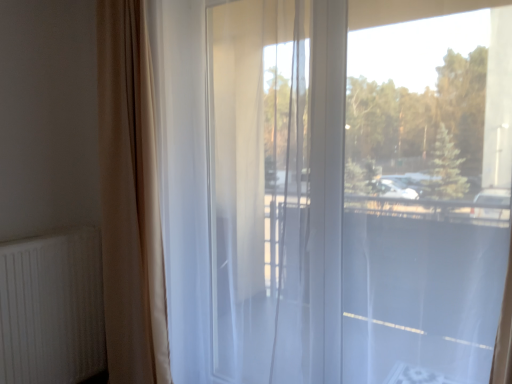
Question: Does transparent glass window at center lie in front of white ribbed radiator at lower left?

Choices:
 (A) yes
 (B) no

Answer: (A)

Question: Can you confirm if transparent glass window at center is positioned to the right of white ribbed radiator at lower left?

Choices:
 (A) yes
 (B) no

Answer: (A)

Question: Is transparent glass window at center completely or partially outside of white ribbed radiator at lower left?

Choices:
 (A) no
 (B) yes

Answer: (B)

Question: From a real-world perspective, is transparent glass window at center positioned under white ribbed radiator at lower left based on gravity?

Choices:
 (A) yes
 (B) no

Answer: (B)

Question: Considering the relative sizes of transparent glass window at center and white ribbed radiator at lower left in the image provided, is transparent glass window at center smaller than white ribbed radiator at lower left?

Choices:
 (A) no
 (B) yes

Answer: (A)

Question: Can you confirm if transparent glass window at center is thinner than white ribbed radiator at lower left?

Choices:
 (A) yes
 (B) no

Answer: (B)

Question: Considering the relative sizes of beige fabric curtain at left and transparent glass window at center in the image provided, is beige fabric curtain at left smaller than transparent glass window at center?

Choices:
 (A) yes
 (B) no

Answer: (A)

Question: Considering the relative positions of beige fabric curtain at left and transparent glass window at center in the image provided, is beige fabric curtain at left to the left of transparent glass window at center from the viewer's perspective?

Choices:
 (A) no
 (B) yes

Answer: (B)

Question: Does beige fabric curtain at left have a lesser height compared to transparent glass window at center?

Choices:
 (A) no
 (B) yes

Answer: (A)

Question: Is beige fabric curtain at left further to camera compared to transparent glass window at center?

Choices:
 (A) yes
 (B) no

Answer: (A)

Question: Is the depth of beige fabric curtain at left less than that of transparent glass window at center?

Choices:
 (A) no
 (B) yes

Answer: (A)

Question: Does beige fabric curtain at left have a greater width compared to transparent glass window at center?

Choices:
 (A) yes
 (B) no

Answer: (A)

Question: Is beige fabric curtain at left at the back of white ribbed radiator at lower left?

Choices:
 (A) yes
 (B) no

Answer: (B)